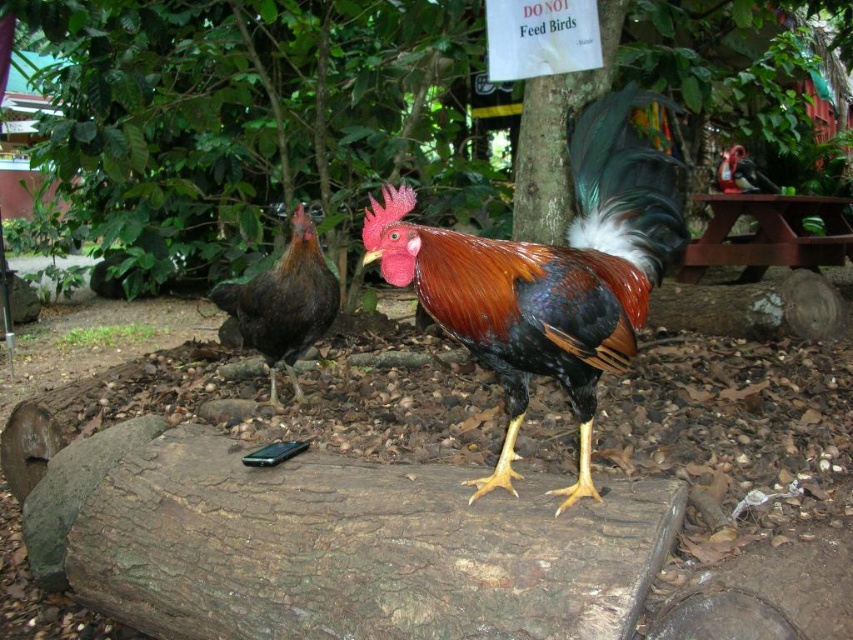
You are a small bird trying to fly from the green leafy tree at center to the dark brown feathers at left. Can you make the jump in one go if your maximum flight distance is 5 feet?

The green leafy tree at center and dark brown feathers at left are 4.87 feet apart from each other, so yes, the small bird can make the jump in one go since the distance is within its maximum flight capability of 5 feet.

Consider the image. You are a photographer trying to capture a clear photo of the shiny multicolored rooster at center and the dark brown feathers at left. Which chicken should you focus on first to ensure both are in focus?

The shiny multicolored rooster at center is in front of the dark brown feathers at left, so you should focus on the shiny multicolored rooster at center first to ensure both are in focus.

You are a birdwatcher observing the scene. You notice the green leafy tree at center and the shiny multicolored rooster at center. Which object is wider?

The green leafy tree at center is wider than the shiny multicolored rooster at center according to the description.